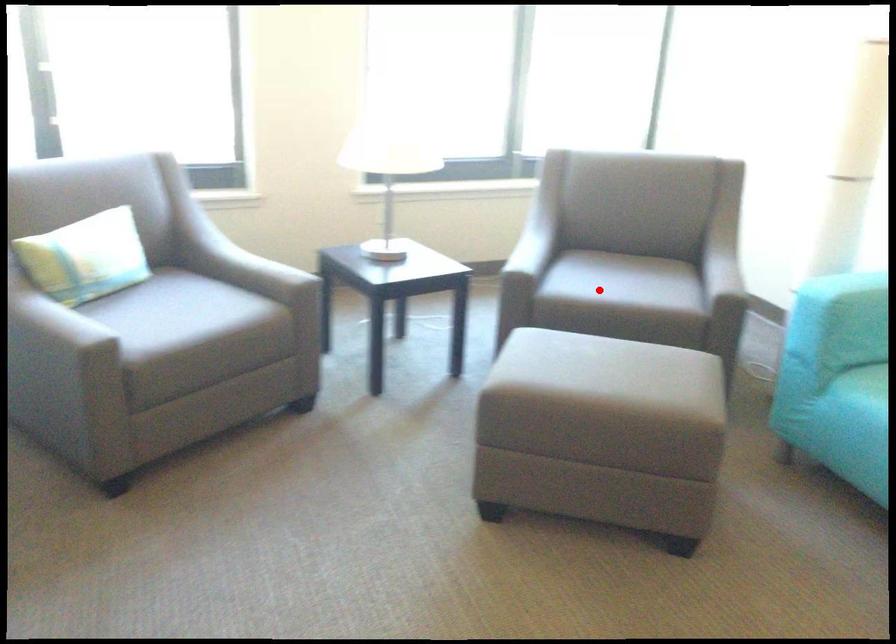
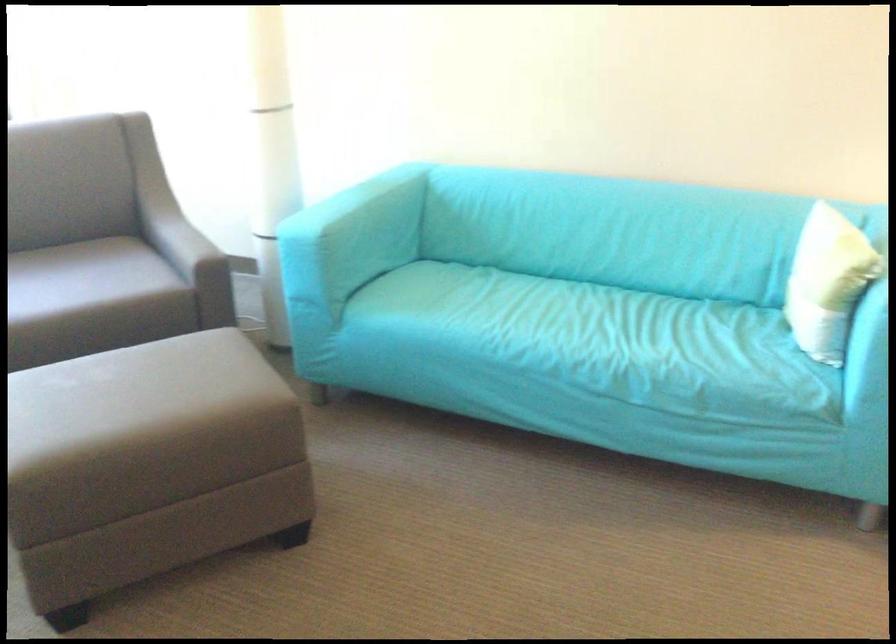
Where in the second image is the point corresponding to the highlighted location from the first image?

(53, 298)